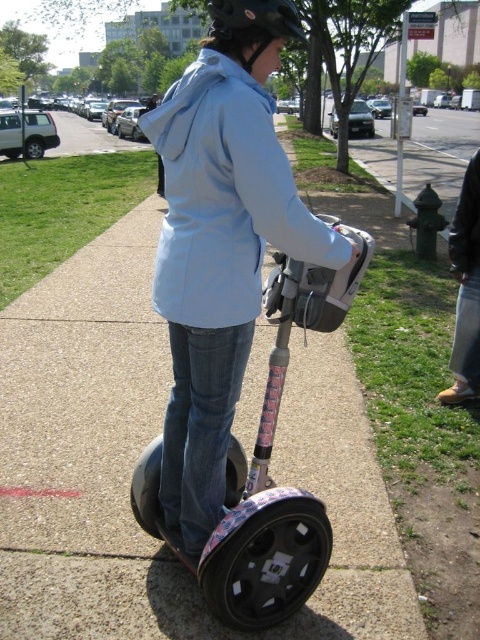
Question: Is light blue fabric sweatshirt at center bigger than black matte helmet at upper center?

Choices:
 (A) no
 (B) yes

Answer: (B)

Question: Does light blue fabric sweatshirt at center appear on the left side of black matte helmet at upper center?

Choices:
 (A) yes
 (B) no

Answer: (A)

Question: Which of the following is the closest to the observer?

Choices:
 (A) pyautogui.click(x=336, y=288)
 (B) pyautogui.click(x=223, y=33)

Answer: (B)

Question: Is metallic pink scooter at center bigger than brown leather shoes at lower right?

Choices:
 (A) yes
 (B) no

Answer: (A)

Question: Which is nearer to the brown leather shoes at lower right?

Choices:
 (A) black matte helmet at upper center
 (B) light blue fabric sweatshirt at center

Answer: (B)

Question: Estimate the real-world distances between objects in this image. Which object is closer to the light blue fabric sweatshirt at center?

Choices:
 (A) black matte helmet at upper center
 (B) brown leather shoes at lower right
 (C) metallic pink scooter at center

Answer: (A)